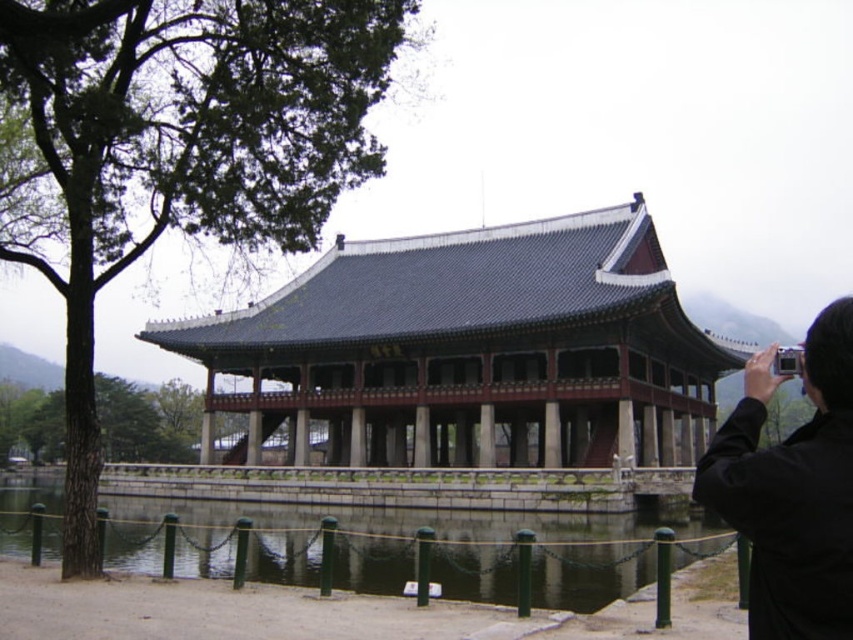
Can you confirm if clear water at pond center is wider than black fabric camera at upper right?

Yes.

Is clear water at pond center taller than black fabric camera at upper right?

Incorrect, clear water at pond center's height is not larger of black fabric camera at upper right's.

Which is in front, point (277, 516) or point (816, 554)?

Point (816, 554) is more forward.

You are a GUI agent. You are given a task and a screenshot of the screen. Output one action in this format:
    pyautogui.click(x=<x>, y=<y>)
    Task: Click on the clear water at pond center
    
    Given the screenshot: What is the action you would take?
    pyautogui.click(x=393, y=548)

Can you confirm if shiny dark gray roof at center is positioned above black fabric camera at upper right?

Indeed, shiny dark gray roof at center is positioned over black fabric camera at upper right.

Between point (392, 467) and point (851, 412), which one is positioned behind?

The point (392, 467) is more distant.

You are a GUI agent. You are given a task and a screenshot of the screen. Output one action in this format:
    pyautogui.click(x=<x>, y=<y>)
    Task: Click on the shiny dark gray roof at center
    This screenshot has width=853, height=640.
    Given the screenshot: What is the action you would take?
    pyautogui.click(x=471, y=352)

Based on the photo, measure the distance from shiny dark gray roof at center to clear water at pond center.

The distance of shiny dark gray roof at center from clear water at pond center is 21.01 meters.

Can you confirm if shiny dark gray roof at center is taller than clear water at pond center?

Correct, shiny dark gray roof at center is much taller as clear water at pond center.

This screenshot has width=853, height=640. Describe the element at coordinates (471, 352) in the screenshot. I see `shiny dark gray roof at center` at that location.

Locate an element on the screen. shiny dark gray roof at center is located at coordinates coord(471,352).